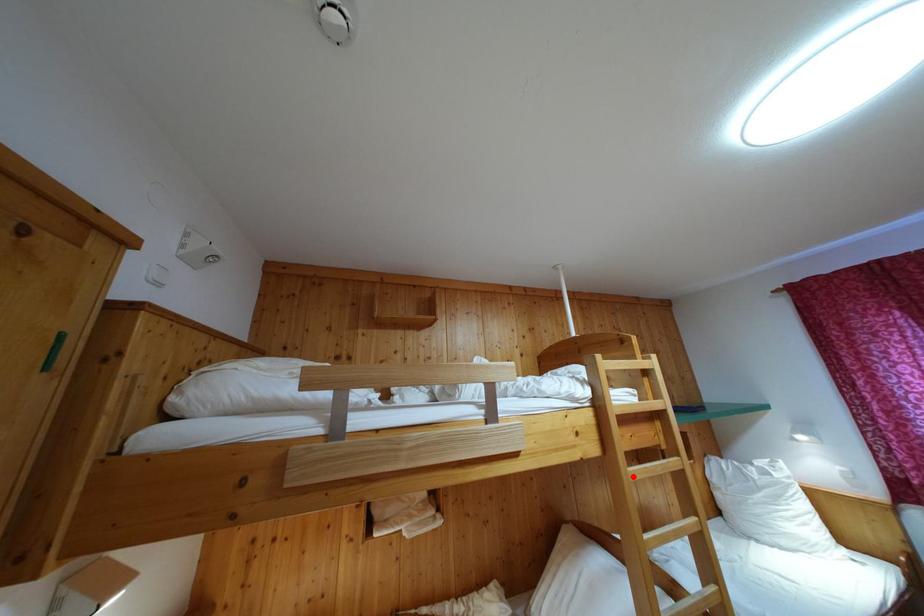
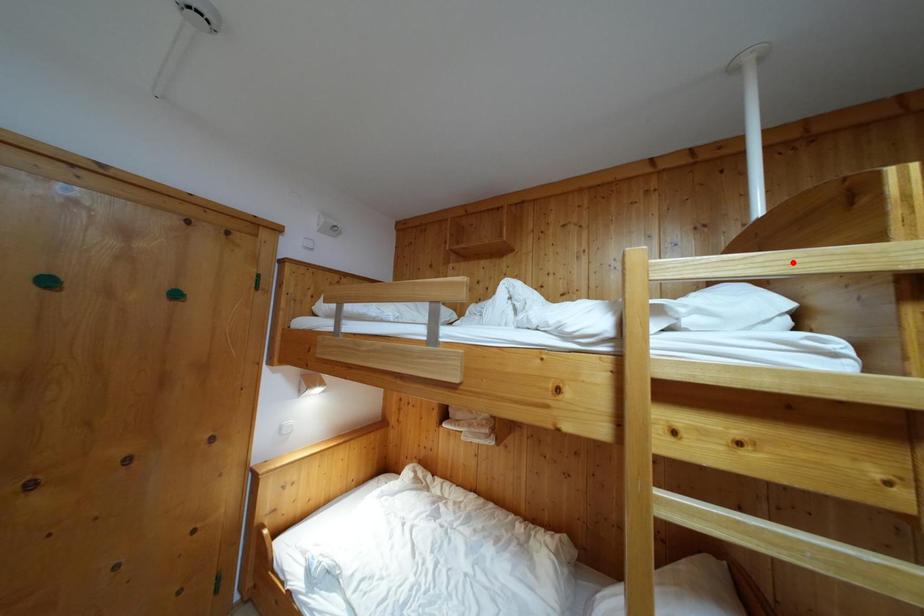
I am providing you with two images of the same scene from different viewpoints. A red point is marked on the first image and another point is marked on the second image. Does the point marked in image1 correspond to the same location as the one in image2?

No